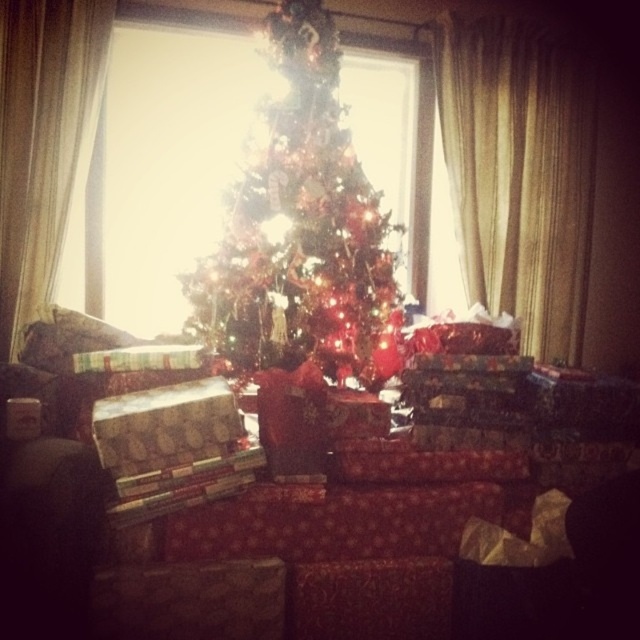
Which of these two, iridescent glass christmas tree at center or gold textured curtain at right, stands shorter?

iridescent glass christmas tree at center is shorter.

Can you confirm if iridescent glass christmas tree at center is positioned to the right of gold textured curtain at right?

In fact, iridescent glass christmas tree at center is to the left of gold textured curtain at right.

The width and height of the screenshot is (640, 640). I want to click on iridescent glass christmas tree at center, so click(x=304, y=230).

Who is positioned more to the right, gold textured curtain at right or white sheer curtain at left?

gold textured curtain at right

Can you confirm if gold textured curtain at right is smaller than white sheer curtain at left?

Incorrect, gold textured curtain at right is not smaller in size than white sheer curtain at left.

Between point (579, 184) and point (60, 13), which one is positioned in front?

Positioned in front is point (60, 13).

Identify the location of gold textured curtain at right. (518, 173).

Does iridescent glass christmas tree at center appear under white sheer curtain at left?

Indeed, iridescent glass christmas tree at center is positioned under white sheer curtain at left.

Where is `iridescent glass christmas tree at center`? iridescent glass christmas tree at center is located at coordinates (304, 230).